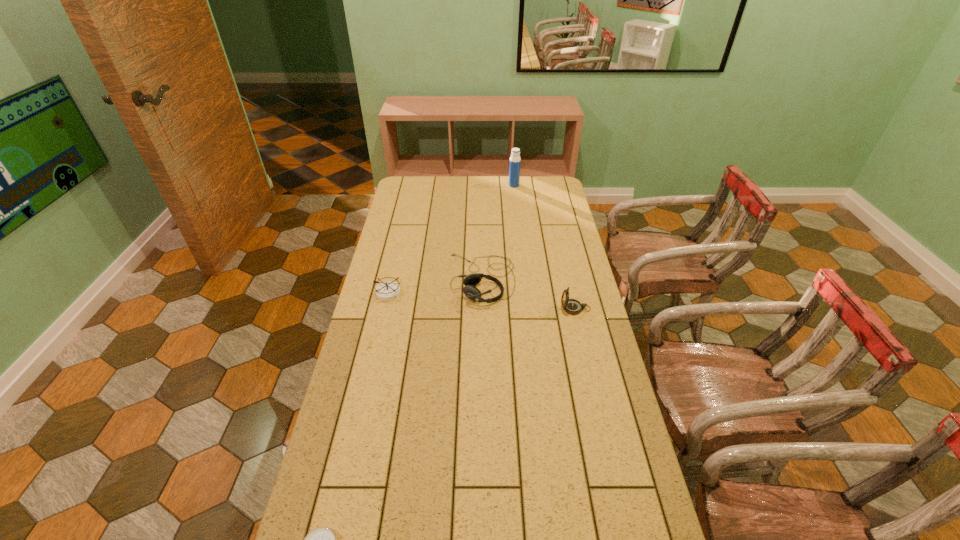
Where is `vacant space at the left edge of the desktop`? Image resolution: width=960 pixels, height=540 pixels. vacant space at the left edge of the desktop is located at coordinates (392, 238).

Identify the location of vacant space at the right edge of the desktop. Image resolution: width=960 pixels, height=540 pixels. click(591, 354).

At what (x,y) coordinates should I click in order to perform the action: click on vacant point at the far right corner. Please return your answer as a coordinate pair (x, y). Image resolution: width=960 pixels, height=540 pixels. Looking at the image, I should click on (545, 195).

I want to click on free spot between the third tallest object and the water bottle, so click(497, 232).

Where is `free space between the tallest object and the farthest compass`? The image size is (960, 540). free space between the tallest object and the farthest compass is located at coordinates (451, 239).

Locate an element on the screen. This screenshot has width=960, height=540. vacant area between the farthest object and the second nearest compass is located at coordinates (544, 247).

In order to click on free area in between the third shortest object and the rightmost object in this screenshot , I will do `click(528, 294)`.

You are a GUI agent. You are given a task and a screenshot of the screen. Output one action in this format:
    pyautogui.click(x=<x>, y=<y>)
    Task: Click on the free space between the fourth tallest object and the third shortest object
    
    Given the screenshot: What is the action you would take?
    pyautogui.click(x=435, y=286)

The height and width of the screenshot is (540, 960). Identify the location of vacant space that is in between the farthest compass and the farthest object. (451, 239).

Image resolution: width=960 pixels, height=540 pixels. Identify the location of object that can be found as the fourth closest to the headset. (322, 539).